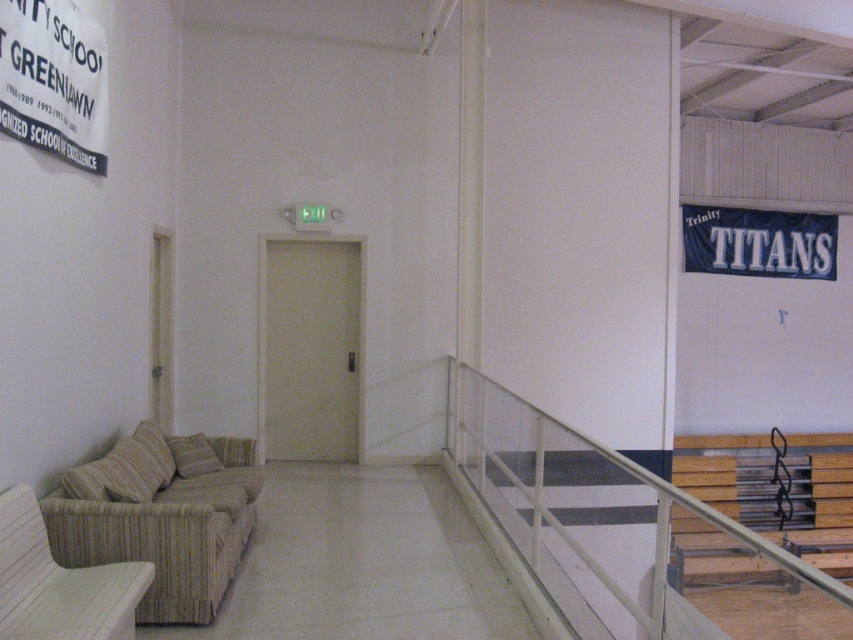
Question: Among these objects, which one is farthest from the camera?

Choices:
 (A) beige woven couch at lower left
 (B) white metal railing at upper right

Answer: (A)

Question: Which of the following is the closest to the observer?

Choices:
 (A) beige woven couch at lower left
 (B) white metal railing at upper right
 (C) woven beige armchair at lower left

Answer: (C)

Question: Is white metal railing at upper right in front of beige fabric pillow at lower left?

Choices:
 (A) no
 (B) yes

Answer: (B)

Question: Is woven beige armchair at lower left below beige fabric pillow at lower left?

Choices:
 (A) no
 (B) yes

Answer: (B)

Question: Which object is the farthest from the beige fabric pillow at lower left?

Choices:
 (A) woven beige armchair at lower left
 (B) white metal railing at upper right

Answer: (B)

Question: Is white metal railing at upper right positioned at the back of beige woven couch at lower left?

Choices:
 (A) yes
 (B) no

Answer: (B)